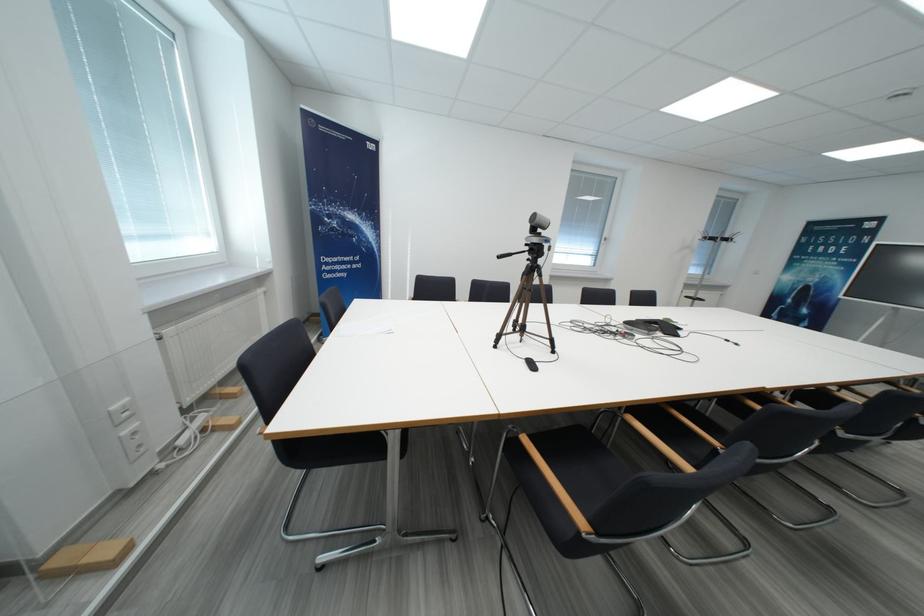
The width and height of the screenshot is (924, 616). In order to click on black remote control in this screenshot , I will do `click(530, 363)`.